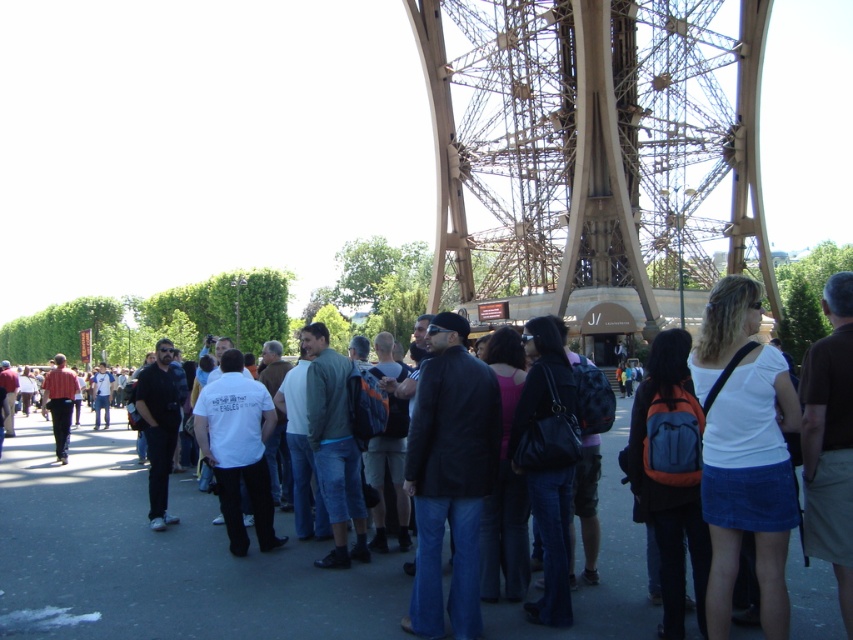
You are standing at the base of the Eiffel Tower and see the point marked at coordinates (593, 144). What does this point represent?

The point at coordinates (593, 144) represents the metallic brown structure at center, which is the Eiffel Tower itself.

You are a photographer standing at the base of the Eiffel Tower and notice a black leather handbag at center and dark blue jeans at center. Which object would appear larger in your camera viewfinder?

The black leather handbag at center appears larger in the camera viewfinder because it is bigger than the dark blue jeans at center.